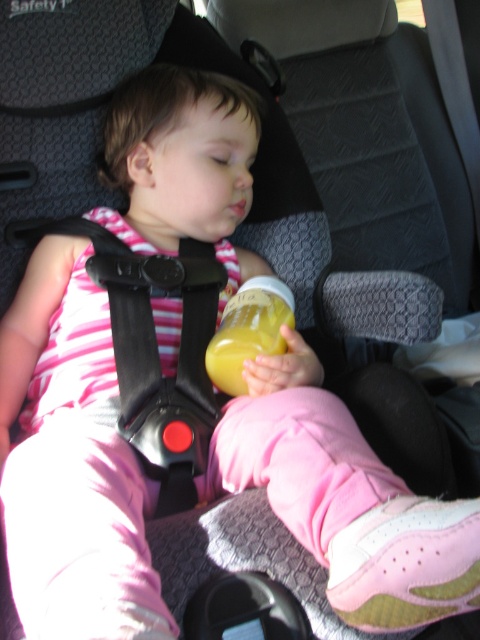
Question: Is black plastic strap at center positioned at the back of yellow matte bottle at center?

Choices:
 (A) no
 (B) yes

Answer: (A)

Question: Does black plastic strap at center come behind yellow matte bottle at center?

Choices:
 (A) yes
 (B) no

Answer: (B)

Question: Among these points, which one is nearest to the camera?

Choices:
 (A) (123, 243)
 (B) (252, 307)

Answer: (B)

Question: Which of the following is the farthest from the observer?

Choices:
 (A) pyautogui.click(x=252, y=324)
 (B) pyautogui.click(x=137, y=435)

Answer: (A)

Question: Can you confirm if black plastic strap at center is positioned to the right of yellow matte bottle at center?

Choices:
 (A) yes
 (B) no

Answer: (B)